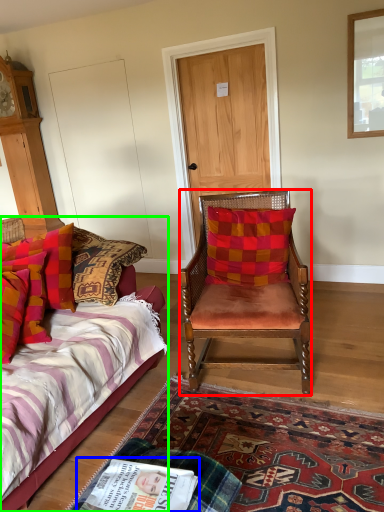
Question: Based on their relative distances, which object is nearer to chair (highlighted by a red box)? Choose from magazine (highlighted by a blue box) and bed (highlighted by a green box).

Choices:
 (A) magazine
 (B) bed

Answer: (B)